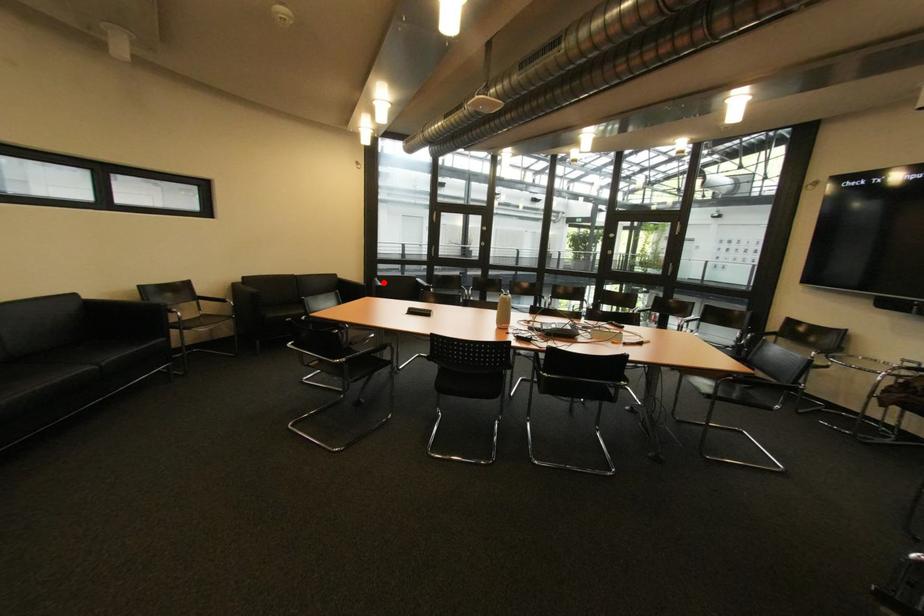
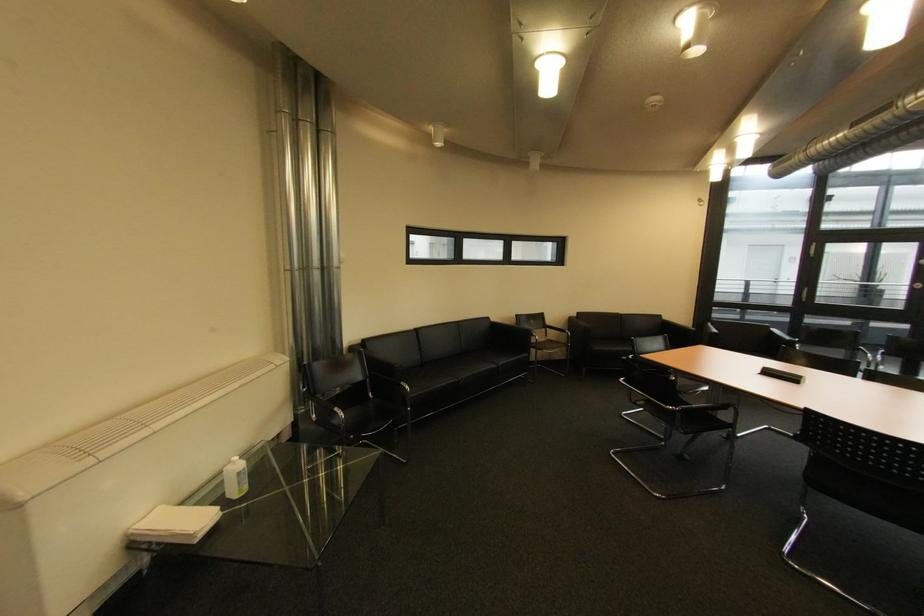
Question: I am providing you with two images of the same scene from different viewpoints. Given a red point in image1, look at the same physical point in image2. Is it:

Choices:
 (A) Closer to the viewpoint
 (B) Farther from the viewpoint

Answer: (B)